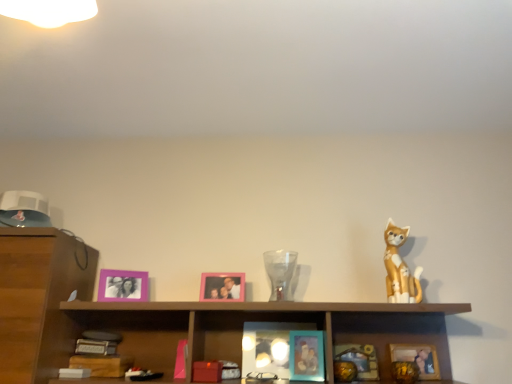
Question: Considering the relative sizes of transparent glass vase at center and teal glossy picture frame at center, positioned as the third picture frame in left-to-right order, in the image provided, is transparent glass vase at center shorter than teal glossy picture frame at center, positioned as the third picture frame in left-to-right order,?

Choices:
 (A) yes
 (B) no

Answer: (B)

Question: Does transparent glass vase at center have a greater height compared to teal glossy picture frame at center, positioned as the third picture frame in left-to-right order?

Choices:
 (A) yes
 (B) no

Answer: (A)

Question: Can you confirm if transparent glass vase at center is thinner than teal glossy picture frame at center, positioned as the third picture frame in left-to-right order?

Choices:
 (A) no
 (B) yes

Answer: (A)

Question: Does transparent glass vase at center appear on the left side of teal glossy picture frame at center, the third picture frame positioned from the right?

Choices:
 (A) yes
 (B) no

Answer: (A)

Question: Is teal glossy picture frame at center, positioned as the third picture frame in left-to-right order, at the back of transparent glass vase at center?

Choices:
 (A) yes
 (B) no

Answer: (B)

Question: Does transparent glass vase at center lie in front of teal glossy picture frame at center, the third picture frame positioned from the right?

Choices:
 (A) yes
 (B) no

Answer: (B)

Question: Can you confirm if teal matte picture frame at lower center, marked as the 2th picture frame in a right-to-left arrangement, is shorter than matte orange cat figurine at right?

Choices:
 (A) yes
 (B) no

Answer: (A)

Question: Is teal matte picture frame at lower center, which is counted as the 4th picture frame, starting from the left, facing towards matte orange cat figurine at right?

Choices:
 (A) yes
 (B) no

Answer: (B)

Question: Is teal matte picture frame at lower center, which is counted as the 4th picture frame, starting from the left, beside matte orange cat figurine at right?

Choices:
 (A) yes
 (B) no

Answer: (B)

Question: From a real-world perspective, is teal matte picture frame at lower center, marked as the 2th picture frame in a right-to-left arrangement, positioned under matte orange cat figurine at right based on gravity?

Choices:
 (A) yes
 (B) no

Answer: (A)

Question: Would you say matte orange cat figurine at right is part of teal matte picture frame at lower center, which is counted as the 4th picture frame, starting from the left,'s contents?

Choices:
 (A) no
 (B) yes

Answer: (A)

Question: Can you confirm if teal matte picture frame at lower center, which is counted as the 4th picture frame, starting from the left, is positioned to the right of matte orange cat figurine at right?

Choices:
 (A) yes
 (B) no

Answer: (B)

Question: Considering the relative sizes of wooden cabinet at center and teal matte picture frame at lower center, which is counted as the 4th picture frame, starting from the left, in the image provided, is wooden cabinet at center smaller than teal matte picture frame at lower center, which is counted as the 4th picture frame, starting from the left,?

Choices:
 (A) yes
 (B) no

Answer: (B)